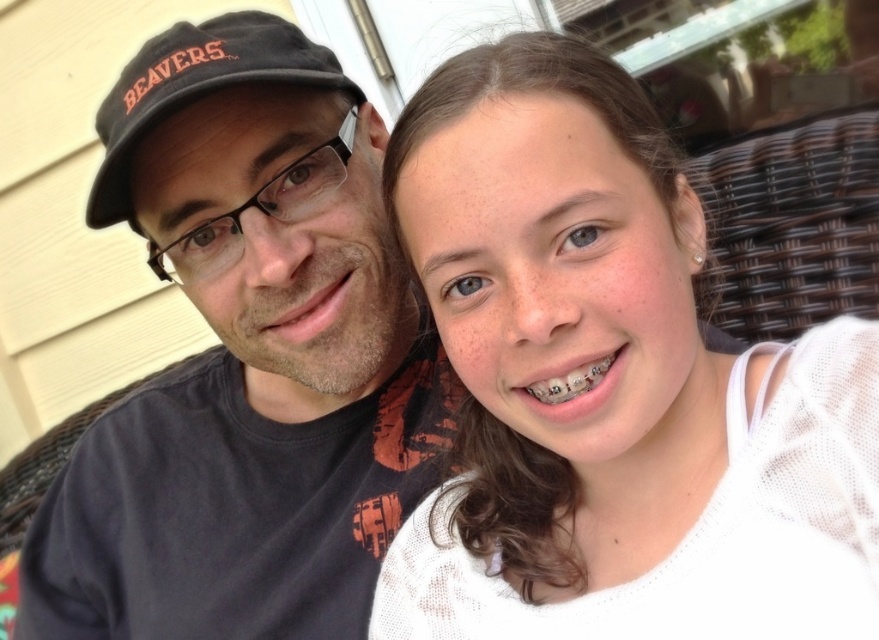
Question: Does white knit sweater at upper right appear on the right side of black fabric baseball cap at upper left?

Choices:
 (A) no
 (B) yes

Answer: (B)

Question: Which object is the farthest from the black fabric baseball cap at upper left?

Choices:
 (A) white knit sweater at upper right
 (B) dark gray t-shirt at left

Answer: (A)

Question: Which of the following is the closest to the observer?

Choices:
 (A) (360, 332)
 (B) (534, 442)
 (C) (120, 216)

Answer: (B)

Question: Is white knit sweater at upper right further to the viewer compared to black fabric baseball cap at upper left?

Choices:
 (A) yes
 (B) no

Answer: (B)

Question: Is white knit sweater at upper right to the right of black fabric baseball cap at upper left from the viewer's perspective?

Choices:
 (A) yes
 (B) no

Answer: (A)

Question: Which point appears farthest from the camera in this image?

Choices:
 (A) (110, 154)
 (B) (300, 241)
 (C) (840, 438)

Answer: (B)